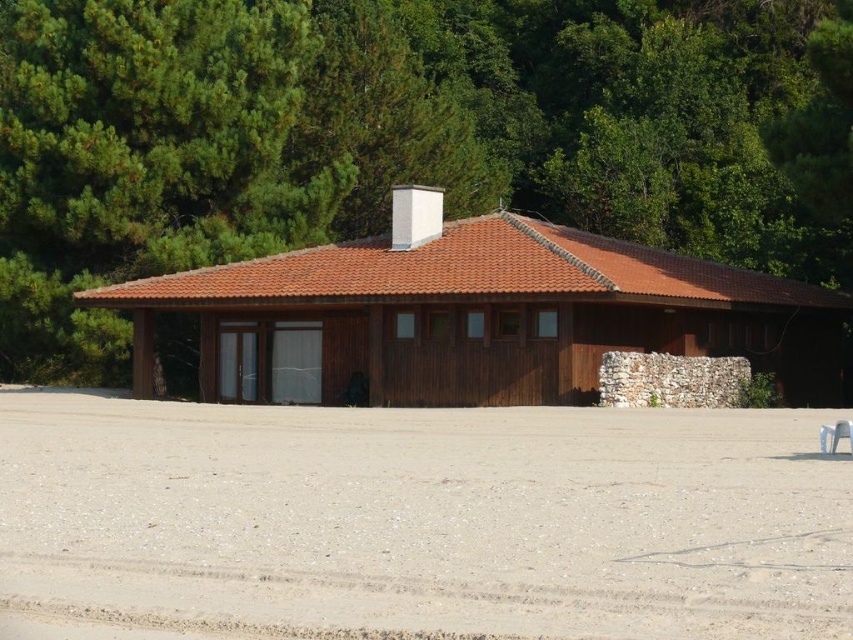
Which is above, green leafy tree at upper center or brown wooden hut at center?

green leafy tree at upper center is above.

Does point (76, 228) come in front of point (554, 340)?

No, (76, 228) is behind (554, 340).

Measure the distance between point (283, 237) and camera.

139.00 feet

You are a GUI agent. You are given a task and a screenshot of the screen. Output one action in this format:
    pyautogui.click(x=<x>, y=<y>)
    Task: Click on the green leafy tree at upper center
    This screenshot has width=853, height=640.
    Given the screenshot: What is the action you would take?
    pyautogui.click(x=389, y=138)

Is point (83, 198) positioned after point (461, 458)?

Yes, it is behind point (461, 458).

Does point (793, 125) come closer to viewer compared to point (57, 465)?

No, it is not.

Identify the location of green leafy tree at upper center. (389, 138).

Is gray gravel at lower center behind brown wooden hut at center?

No, it is in front of brown wooden hut at center.

Is gray gravel at lower center bigger than brown wooden hut at center?

Incorrect, gray gravel at lower center is not larger than brown wooden hut at center.

Between point (685, 560) and point (813, 333), which one is positioned in front?

Point (685, 560) is more forward.

Identify the location of gray gravel at lower center. This screenshot has height=640, width=853. (430, 516).